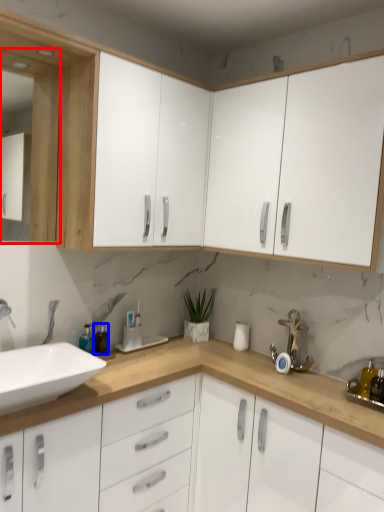
Question: Among these objects, which one is farthest to the camera, medicine cabinet (highlighted by a red box) or bottle (highlighted by a blue box)?

Choices:
 (A) medicine cabinet
 (B) bottle

Answer: (B)